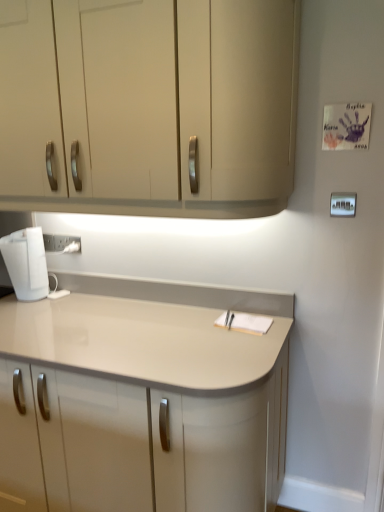
Question: Is point (49, 62) closer or farther from the camera than point (46, 352)?

Choices:
 (A) farther
 (B) closer

Answer: (A)

Question: Considering the positions of matte beige cabinet at upper center and matte beige countertop at center in the image, is matte beige cabinet at upper center taller or shorter than matte beige countertop at center?

Choices:
 (A) tall
 (B) short

Answer: (B)

Question: Which is farther from the white glossy kettle at lower left?

Choices:
 (A) white plastic electric outlet at lower left
 (B) matte beige cabinet at upper center
 (C) white plastic light switch at upper right
 (D) matte beige countertop at center

Answer: (C)

Question: Which object is positioned closest to the white plastic light switch at upper right?

Choices:
 (A) matte beige countertop at center
 (B) white glossy kettle at lower left
 (C) white plastic electric outlet at lower left
 (D) matte beige cabinet at upper center

Answer: (D)